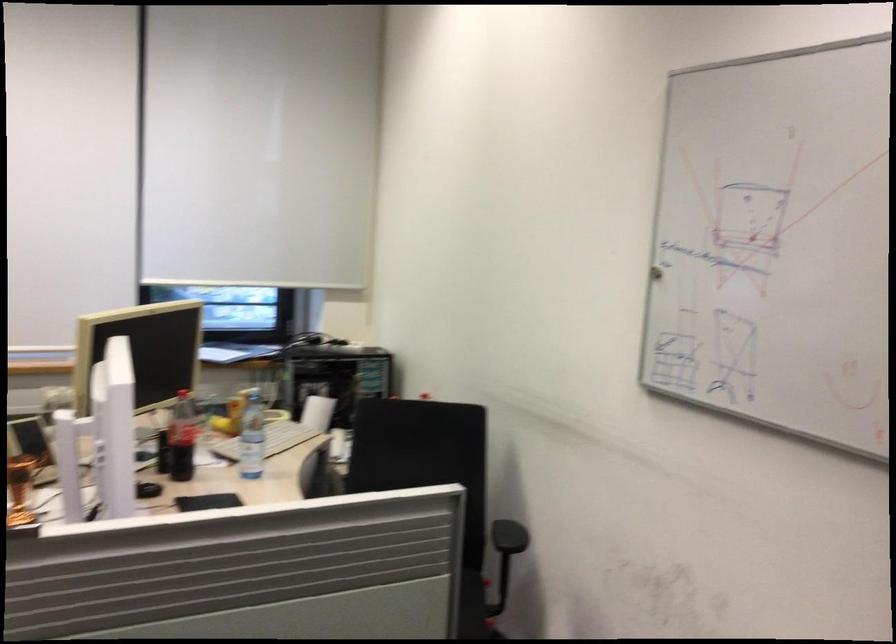
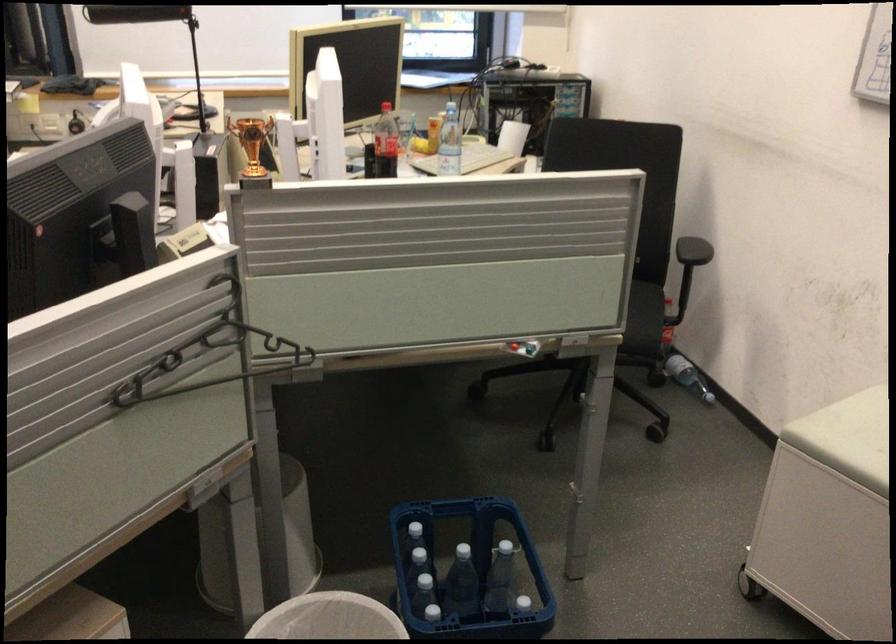
Question: I am providing you with two images of the same scene from different viewpoints. Please identify which objects are invisible in image2.

Choices:
 (A) white trash can
 (B) red button
 (C) coca-cola bottle
 (D) none of these

Answer: (D)